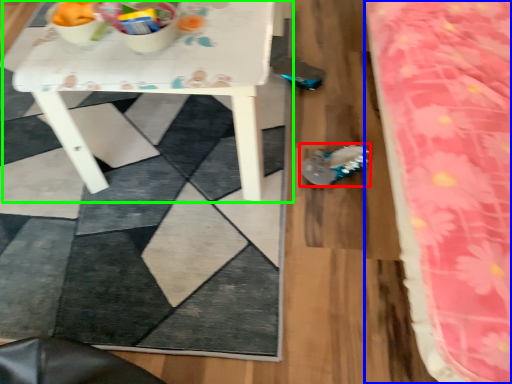
Question: Which object is the closest to the footwear (highlighted by a red box)? Choose among these: bed (highlighted by a blue box) or table (highlighted by a green box).

Choices:
 (A) bed
 (B) table

Answer: (B)